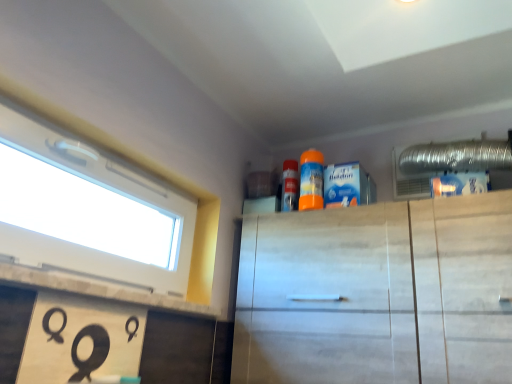
Question: Does white plastic window at upper left have a lesser width compared to orange matte spray can at upper center?

Choices:
 (A) no
 (B) yes

Answer: (A)

Question: From the image's perspective, would you say white plastic window at upper left is positioned over orange matte spray can at upper center?

Choices:
 (A) no
 (B) yes

Answer: (A)

Question: Would you say white plastic window at upper left is a long distance from orange matte spray can at upper center?

Choices:
 (A) yes
 (B) no

Answer: (A)

Question: Does white plastic window at upper left have a greater height compared to orange matte spray can at upper center?

Choices:
 (A) yes
 (B) no

Answer: (A)

Question: Is white plastic window at upper left bigger than orange matte spray can at upper center?

Choices:
 (A) no
 (B) yes

Answer: (B)

Question: Is white plastic window at upper left oriented away from orange matte spray can at upper center?

Choices:
 (A) yes
 (B) no

Answer: (B)

Question: Is orange matte spray can at upper center closer to the viewer compared to white marble cabinet at upper center?

Choices:
 (A) no
 (B) yes

Answer: (A)

Question: Is orange matte spray can at upper center positioned with its back to white marble cabinet at upper center?

Choices:
 (A) yes
 (B) no

Answer: (B)

Question: Considering the relative sizes of orange matte spray can at upper center and white marble cabinet at upper center in the image provided, is orange matte spray can at upper center wider than white marble cabinet at upper center?

Choices:
 (A) yes
 (B) no

Answer: (B)

Question: From a real-world perspective, is orange matte spray can at upper center on white marble cabinet at upper center?

Choices:
 (A) yes
 (B) no

Answer: (A)

Question: Is orange matte spray can at upper center placed right next to white marble cabinet at upper center?

Choices:
 (A) yes
 (B) no

Answer: (B)

Question: Considering the relative positions of orange matte spray can at upper center and white marble cabinet at upper center in the image provided, is orange matte spray can at upper center to the left of white marble cabinet at upper center from the viewer's perspective?

Choices:
 (A) no
 (B) yes

Answer: (B)

Question: Is white marble cabinet at upper center located outside white plastic window at upper left?

Choices:
 (A) no
 (B) yes

Answer: (B)